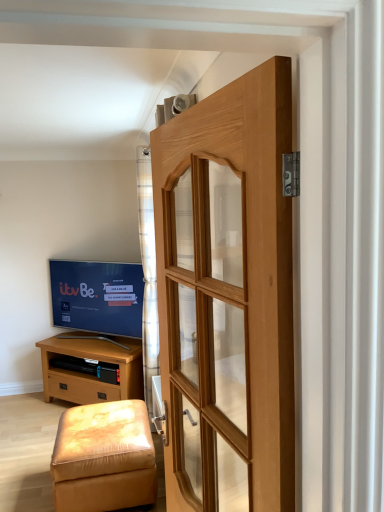
Question: From a real-world perspective, is light brown wood chest of drawers at lower left on plaid fabric curtain at center?

Choices:
 (A) no
 (B) yes

Answer: (A)

Question: Does light brown wood chest of drawers at lower left come in front of plaid fabric curtain at center?

Choices:
 (A) yes
 (B) no

Answer: (B)

Question: Is light brown wood chest of drawers at lower left bigger than plaid fabric curtain at center?

Choices:
 (A) yes
 (B) no

Answer: (A)

Question: From a real-world perspective, is light brown wood chest of drawers at lower left physically below plaid fabric curtain at center?

Choices:
 (A) no
 (B) yes

Answer: (B)

Question: Is light brown wood chest of drawers at lower left completely or partially outside of plaid fabric curtain at center?

Choices:
 (A) yes
 (B) no

Answer: (A)

Question: From their relative heights in the image, would you say light brown wood chest of drawers at lower left is taller or shorter than leather-like beige stool at lower left?

Choices:
 (A) tall
 (B) short

Answer: (A)

Question: From a real-world perspective, relative to leather-like beige stool at lower left, is light brown wood chest of drawers at lower left vertically above or below?

Choices:
 (A) above
 (B) below

Answer: (A)

Question: Is point (72, 349) closer or farther from the camera than point (142, 437)?

Choices:
 (A) closer
 (B) farther

Answer: (B)

Question: From the image's perspective, is light brown wood chest of drawers at lower left located above or below leather-like beige stool at lower left?

Choices:
 (A) below
 (B) above

Answer: (B)

Question: Considering the positions of matte black tv at left and leather-like beige stool at lower left in the image, is matte black tv at left bigger or smaller than leather-like beige stool at lower left?

Choices:
 (A) big
 (B) small

Answer: (B)

Question: Visually, is matte black tv at left positioned to the left or to the right of leather-like beige stool at lower left?

Choices:
 (A) left
 (B) right

Answer: (A)

Question: From the image's perspective, is matte black tv at left positioned above or below leather-like beige stool at lower left?

Choices:
 (A) below
 (B) above

Answer: (B)

Question: Is matte black tv at left spatially inside leather-like beige stool at lower left, or outside of it?

Choices:
 (A) outside
 (B) inside

Answer: (A)

Question: Based on their positions, is plaid fabric curtain at center located to the left or right of natural wood door at center?

Choices:
 (A) right
 (B) left

Answer: (B)

Question: Based on their sizes in the image, would you say plaid fabric curtain at center is bigger or smaller than natural wood door at center?

Choices:
 (A) small
 (B) big

Answer: (A)